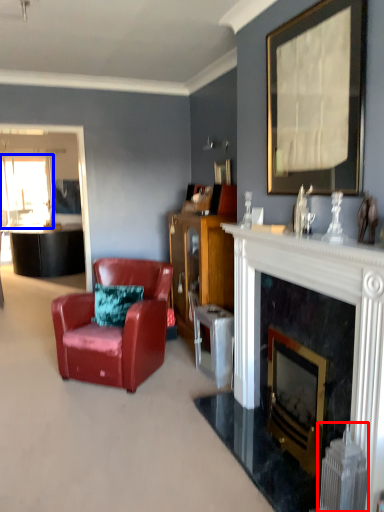
Question: Among these objects, which one is farthest to the camera, radiator (highlighted by a red box) or window screen (highlighted by a blue box)?

Choices:
 (A) radiator
 (B) window screen

Answer: (B)